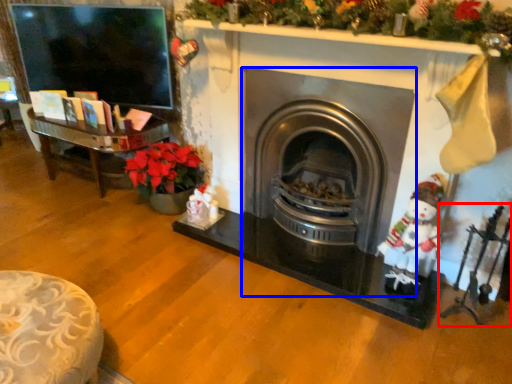
Question: Which object appears closest to the camera in this image, toy (highlighted by a red box) or wood burning stove (highlighted by a blue box)?

Choices:
 (A) toy
 (B) wood burning stove

Answer: (A)